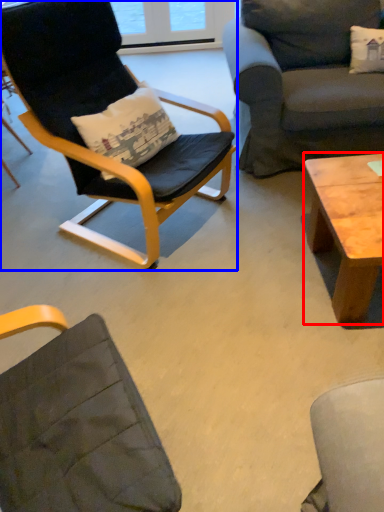
Question: Which of the following is the closest to the observer, coffee table (highlighted by a red box) or chair (highlighted by a blue box)?

Choices:
 (A) coffee table
 (B) chair

Answer: (B)